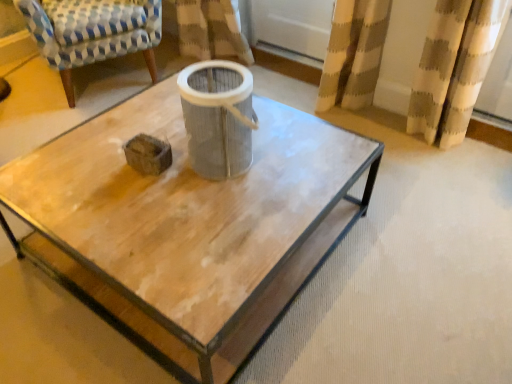
Question: Can you confirm if gray fabric filter at center is thinner than blue and white checkered fabric armchair at upper left?

Choices:
 (A) no
 (B) yes

Answer: (B)

Question: Can you confirm if gray fabric filter at center is taller than blue and white checkered fabric armchair at upper left?

Choices:
 (A) yes
 (B) no

Answer: (B)

Question: Is blue and white checkered fabric armchair at upper left inside gray fabric filter at center?

Choices:
 (A) yes
 (B) no

Answer: (B)

Question: Is gray fabric filter at center oriented towards blue and white checkered fabric armchair at upper left?

Choices:
 (A) yes
 (B) no

Answer: (B)

Question: Is gray fabric filter at center at the right side of blue and white checkered fabric armchair at upper left?

Choices:
 (A) yes
 (B) no

Answer: (A)

Question: From the image's perspective, is gray fabric filter at center located beneath blue and white checkered fabric armchair at upper left?

Choices:
 (A) yes
 (B) no

Answer: (A)

Question: Is wooden coffee table at center in front of gray fabric filter at center?

Choices:
 (A) no
 (B) yes

Answer: (B)

Question: From the image's perspective, is wooden coffee table at center below gray fabric filter at center?

Choices:
 (A) no
 (B) yes

Answer: (B)

Question: Is wooden coffee table at center oriented towards gray fabric filter at center?

Choices:
 (A) yes
 (B) no

Answer: (B)

Question: Is wooden coffee table at center taller than gray fabric filter at center?

Choices:
 (A) yes
 (B) no

Answer: (B)

Question: Is wooden coffee table at center wider than gray fabric filter at center?

Choices:
 (A) yes
 (B) no

Answer: (A)

Question: Does wooden coffee table at center appear on the left side of gray fabric filter at center?

Choices:
 (A) yes
 (B) no

Answer: (A)

Question: Does wooden coffee table at center come in front of blue and white checkered fabric armchair at upper left?

Choices:
 (A) yes
 (B) no

Answer: (A)